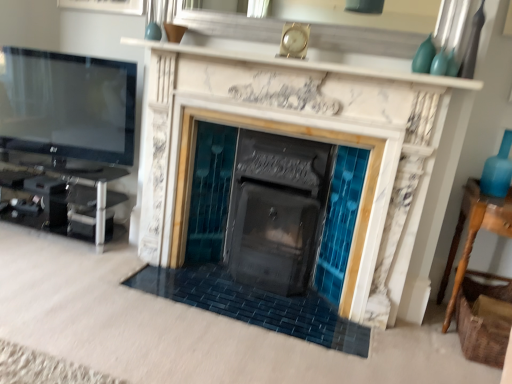
What are the coordinates of `free space to the left of turquoise glass vase at upper right, which is the second turquoise in back-to-front order` in the screenshot? It's located at (411, 70).